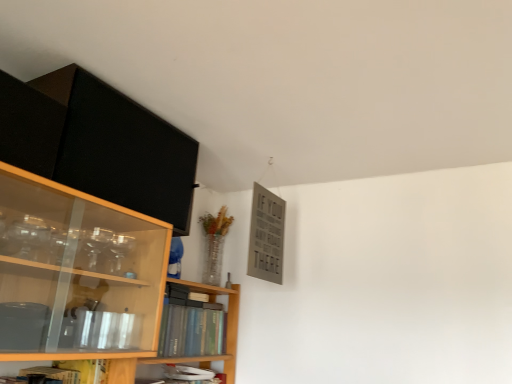
Question: Is hardcover book at lower center, placed as the 2th book when sorted from top to bottom, to the left of hardcover book at center, which is the second book from bottom to top, from the viewer's perspective?

Choices:
 (A) no
 (B) yes

Answer: (A)

Question: Is hardcover book at lower center, placed as the 2th book when sorted from top to bottom, positioned behind hardcover book at center, the first book when ordered from top to bottom?

Choices:
 (A) yes
 (B) no

Answer: (A)

Question: Can you confirm if hardcover book at lower center, which is counted as the 1th book, starting from the bottom, is thinner than hardcover book at center, the first book when ordered from top to bottom?

Choices:
 (A) yes
 (B) no

Answer: (A)

Question: Does hardcover book at lower center, which is counted as the 1th book, starting from the bottom, have a smaller size compared to hardcover book at center, which is the second book from bottom to top?

Choices:
 (A) yes
 (B) no

Answer: (A)

Question: Is hardcover book at lower center, placed as the 2th book when sorted from top to bottom, aimed at hardcover book at center, the first book when ordered from top to bottom?

Choices:
 (A) yes
 (B) no

Answer: (B)

Question: From a real-world perspective, is hardcover book at lower center, which is counted as the 1th book, starting from the bottom, below hardcover book at center, which is the second book from bottom to top?

Choices:
 (A) yes
 (B) no

Answer: (A)

Question: Is matte black cabinet at upper left thinner than hardcover book at lower center, placed as the 2th book when sorted from top to bottom?

Choices:
 (A) no
 (B) yes

Answer: (A)

Question: Can you confirm if matte black cabinet at upper left is taller than hardcover book at lower center, which is counted as the 1th book, starting from the bottom?

Choices:
 (A) no
 (B) yes

Answer: (B)

Question: Is matte black cabinet at upper left outside hardcover book at lower center, which is counted as the 1th book, starting from the bottom?

Choices:
 (A) yes
 (B) no

Answer: (A)

Question: Is matte black cabinet at upper left beside hardcover book at lower center, placed as the 2th book when sorted from top to bottom?

Choices:
 (A) no
 (B) yes

Answer: (A)

Question: Considering the relative sizes of matte black cabinet at upper left and hardcover book at lower center, which is counted as the 1th book, starting from the bottom, in the image provided, is matte black cabinet at upper left shorter than hardcover book at lower center, which is counted as the 1th book, starting from the bottom,?

Choices:
 (A) yes
 (B) no

Answer: (B)

Question: Is matte black cabinet at upper left aimed at hardcover book at lower center, placed as the 2th book when sorted from top to bottom?

Choices:
 (A) no
 (B) yes

Answer: (A)

Question: Is hardcover book at center, which is the second book from bottom to top, positioned with its back to matte black cabinet at upper left?

Choices:
 (A) yes
 (B) no

Answer: (B)